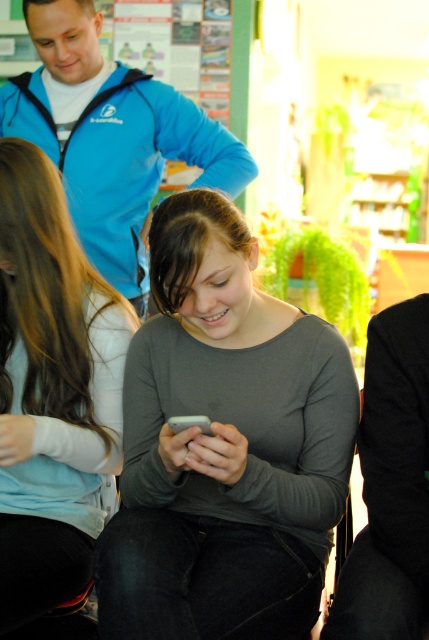
Question: From the image, what is the correct spatial relationship of light brown hair at left in relation to blue fleece jacket at upper left?

Choices:
 (A) above
 (B) below

Answer: (B)

Question: Estimate the real-world distances between objects in this image. Which object is closer to the gray matte shirt at center?

Choices:
 (A) light brown hair at left
 (B) blue fleece jacket at upper left

Answer: (A)

Question: Does gray matte shirt at center come in front of blue fleece jacket at upper left?

Choices:
 (A) no
 (B) yes

Answer: (B)

Question: Which object is positioned closest to the blue fleece jacket at upper left?

Choices:
 (A) gray matte shirt at center
 (B) light brown hair at left

Answer: (B)

Question: Which object is farther from the camera taking this photo?

Choices:
 (A) gray matte shirt at center
 (B) blue fleece jacket at upper left

Answer: (B)

Question: Does gray matte shirt at center appear under blue fleece jacket at upper left?

Choices:
 (A) no
 (B) yes

Answer: (B)